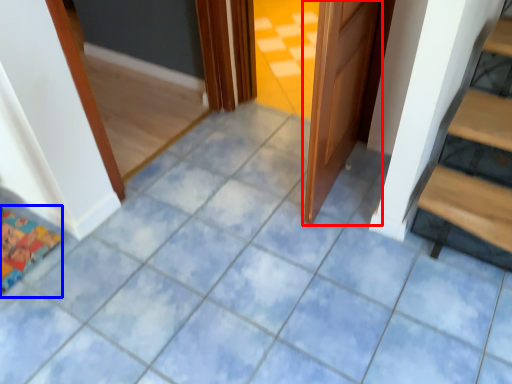
Question: Which object appears farthest to the camera in this image, door (highlighted by a red box) or doormat (highlighted by a blue box)?

Choices:
 (A) door
 (B) doormat

Answer: (B)